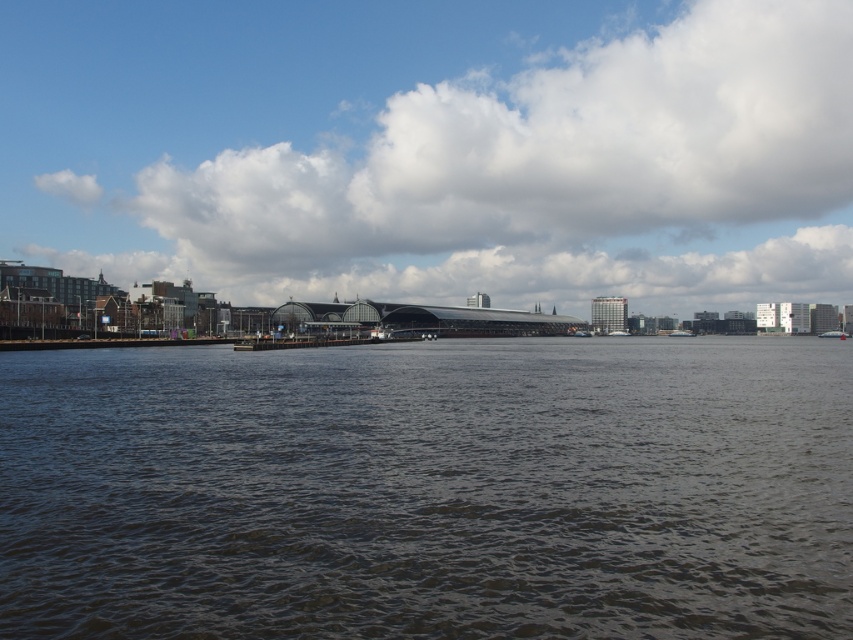
You are a photographer planning to take a wide shot of the scene. You want to ensure both the white plastic boat at right and the metallic silver boat at center are clearly visible. Considering their sizes, which boat will appear bigger in the photo?

The white plastic boat at right will appear bigger in the photo because it has a larger size compared to the metallic silver boat at center.